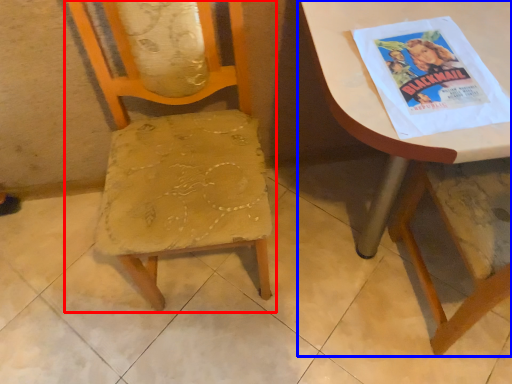
Question: Which object is closer to the camera taking this photo, chair (highlighted by a red box) or table (highlighted by a blue box)?

Choices:
 (A) chair
 (B) table

Answer: (A)